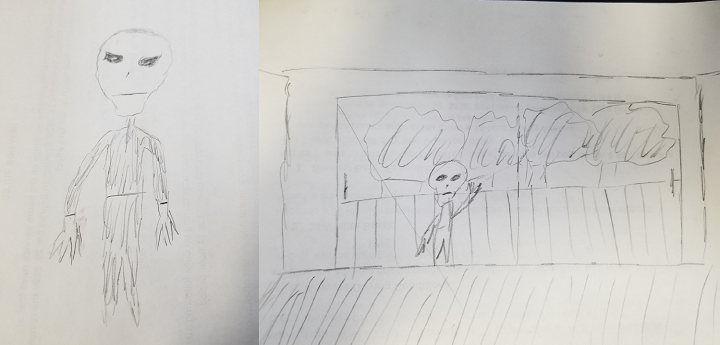
The image size is (720, 345). What are the coordinates of `door handles` in the screenshot? It's located at click(x=353, y=189), click(x=683, y=181).